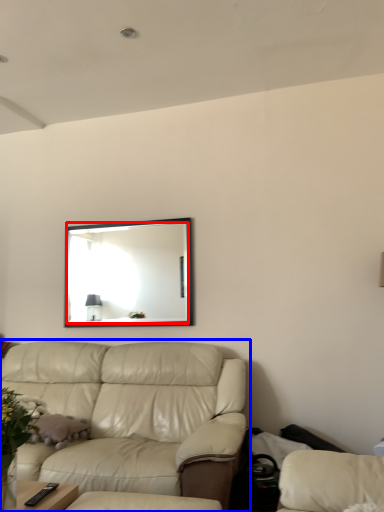
Question: Among these objects, which one is nearest to the camera, mirror (highlighted by a red box) or studio couch (highlighted by a blue box)?

Choices:
 (A) mirror
 (B) studio couch

Answer: (B)